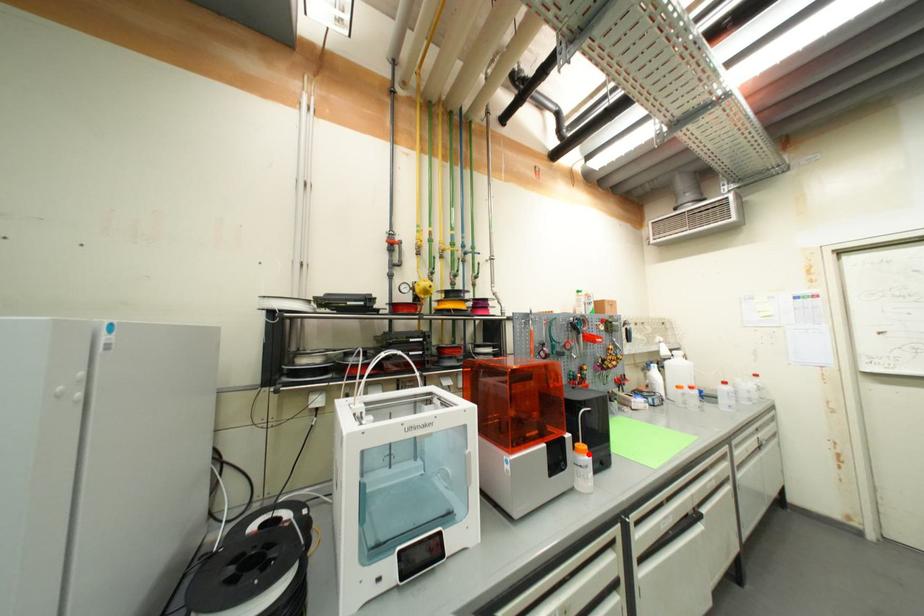
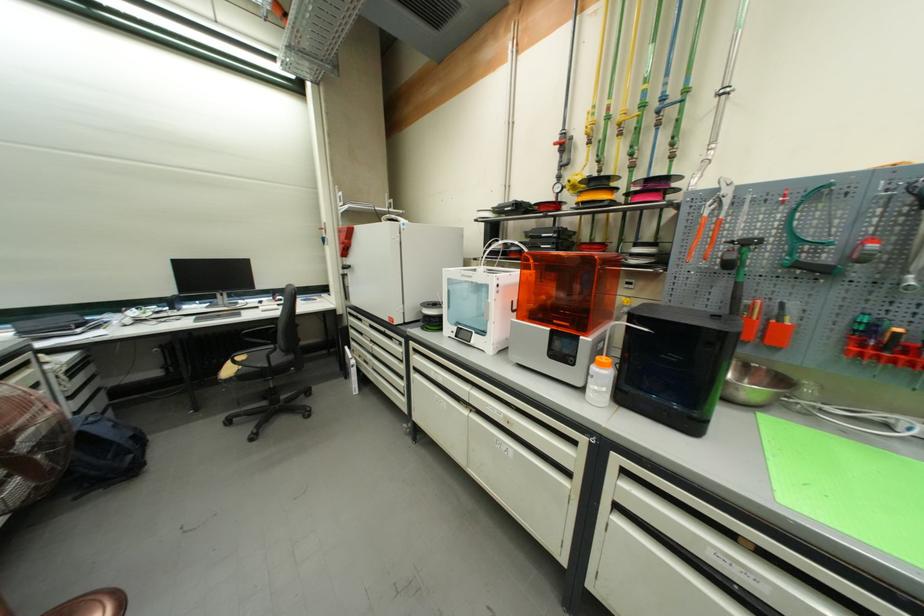
Where in the second image is the point corresponding to the highlighted location from the first image?

(606, 367)